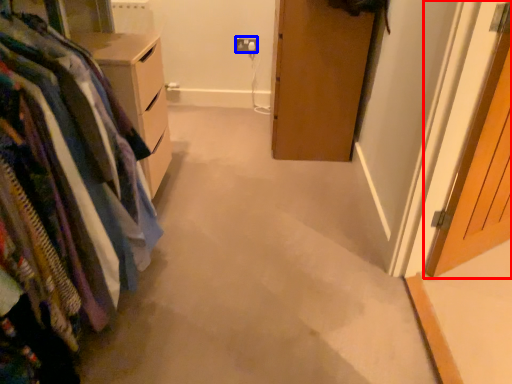
Question: Which of the following is the closest to the observer, door (highlighted by a red box) or electric outlet (highlighted by a blue box)?

Choices:
 (A) door
 (B) electric outlet

Answer: (A)